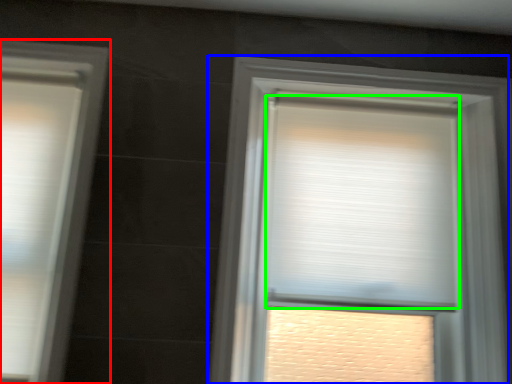
Question: Considering the real-world distances, which object is farthest from window (highlighted by a red box)? window (highlighted by a blue box) or window blind (highlighted by a green box)?

Choices:
 (A) window
 (B) window blind

Answer: (B)